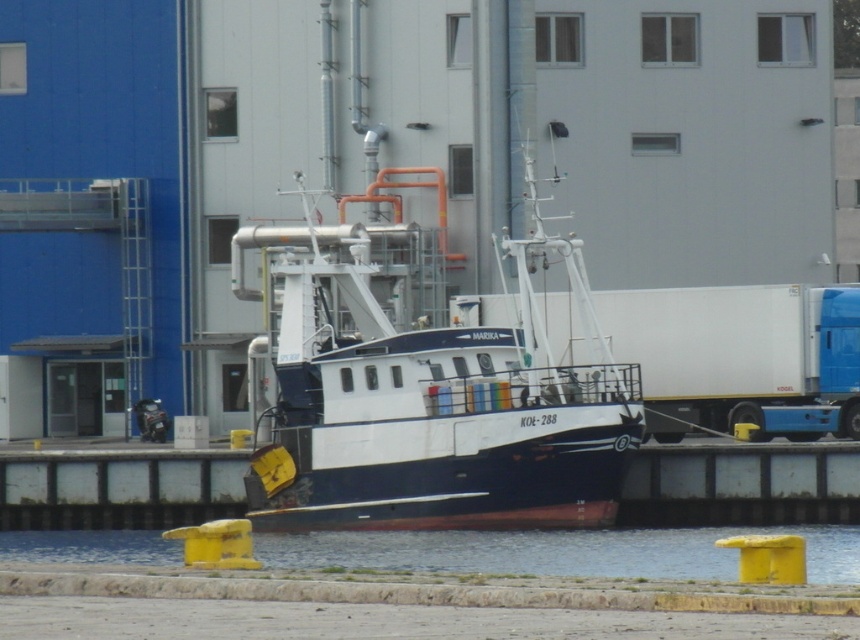
You are a dock worker standing on the dock and looking at the two points on the boat named Marika. Which point, point (748, 353) or point (560, 566), is closer to you?

Point (748, 353) is closer to you because it is further to the viewer than point (560, 566).

You are a dock worker who needs to secure the white matte boat at center to the dock. The safety regulations require that the boat must be within 5 meters of the transparent water at lower center to safely attach the mooring lines. Can you safely secure the boat according to the regulations?

Result: The distance between the white matte boat at center and the transparent water at lower center is 4.85 meters, which is within the 5 meter requirement. Therefore, you can safely secure the boat according to the regulations.

You are a dock worker who needs to secure the white matte boat at center to the dock. The transparent water at lower center is currently lapping against the boat. Which part of the boat is above the water level?

The white matte boat at center is taller than the transparent water at lower center, so the upper sections of the boat are above the water level.